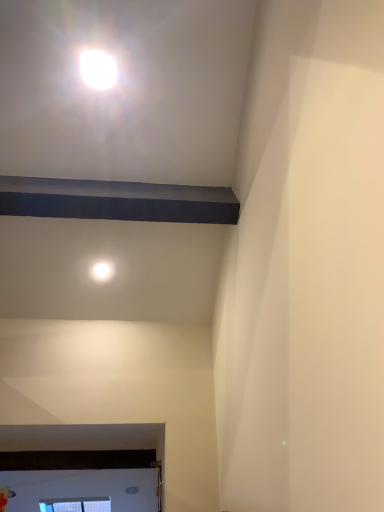
Measure the distance between point (101,277) and camera.

Point (101,277) is 2.06 meters from camera.

What do you see at coordinates (102, 270) in the screenshot? I see `white glossy light fixture at upper center` at bounding box center [102, 270].

Where is `white glossy light fixture at upper center`? This screenshot has height=512, width=384. white glossy light fixture at upper center is located at coordinates (102, 270).

Locate an element on the screen. This screenshot has height=512, width=384. white glossy light fixture at upper center is located at coordinates (102, 270).